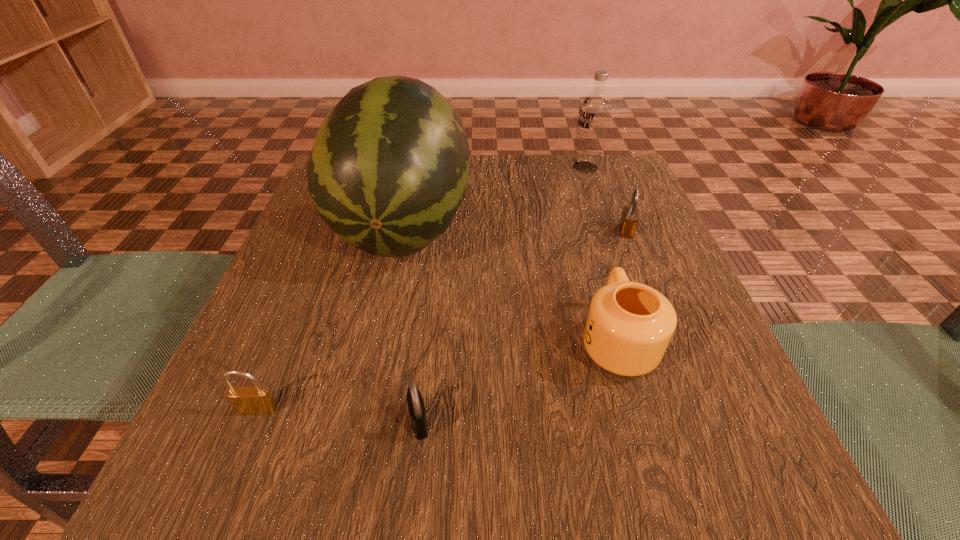
The height and width of the screenshot is (540, 960). What are the coordinates of `watermelon that is at the left edge` in the screenshot? It's located at (388, 171).

Image resolution: width=960 pixels, height=540 pixels. Identify the location of padlock located in the left edge section of the desktop. click(250, 400).

The width and height of the screenshot is (960, 540). Identify the location of vodka that is at the right edge. (595, 108).

Where is `mug located at the right edge`? The height and width of the screenshot is (540, 960). mug located at the right edge is located at coordinates (629, 325).

This screenshot has width=960, height=540. Find the location of `padlock that is at the right edge`. padlock that is at the right edge is located at coordinates (629, 219).

The image size is (960, 540). I want to click on object present at the far left corner, so click(x=388, y=171).

Identify the location of object at the far right corner. (595, 108).

Image resolution: width=960 pixels, height=540 pixels. In order to click on free space at the far edge of the desktop in this screenshot , I will do `click(548, 204)`.

This screenshot has height=540, width=960. In the image, there is a desktop. Identify the location of free space at the near edge. (543, 474).

Find the location of a particular element. vacant position at the left edge of the desktop is located at coordinates (309, 305).